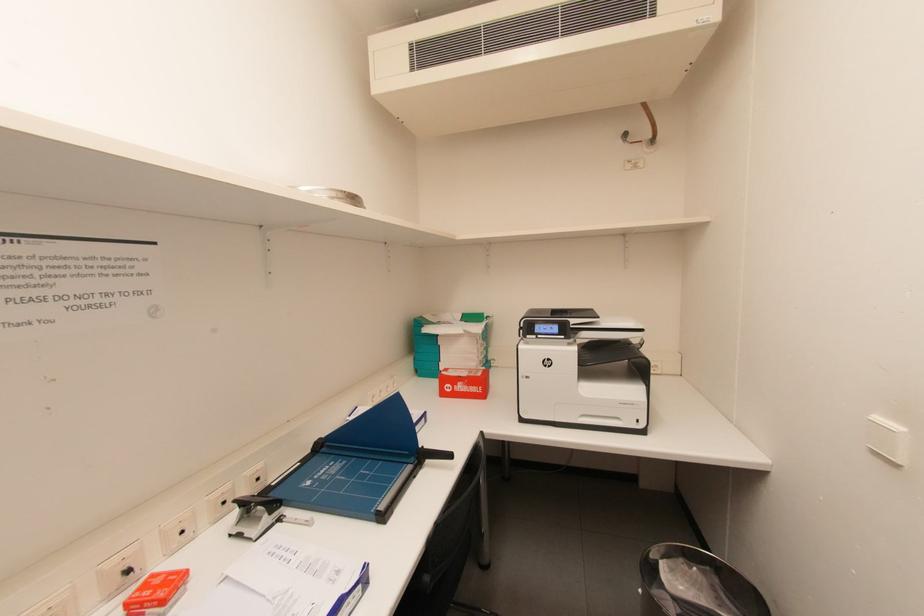
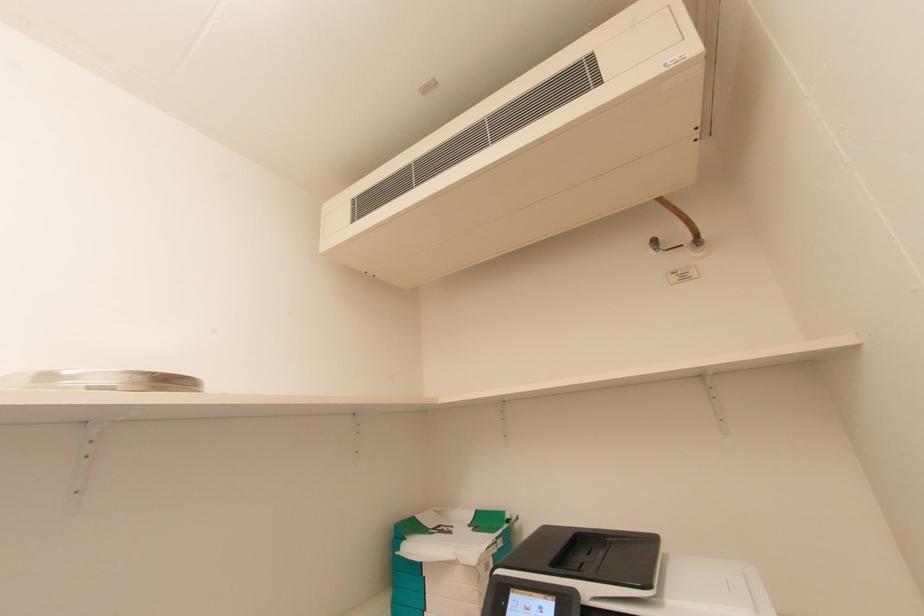
How did the camera likely rotate?

The rotation direction of the camera is left-up.